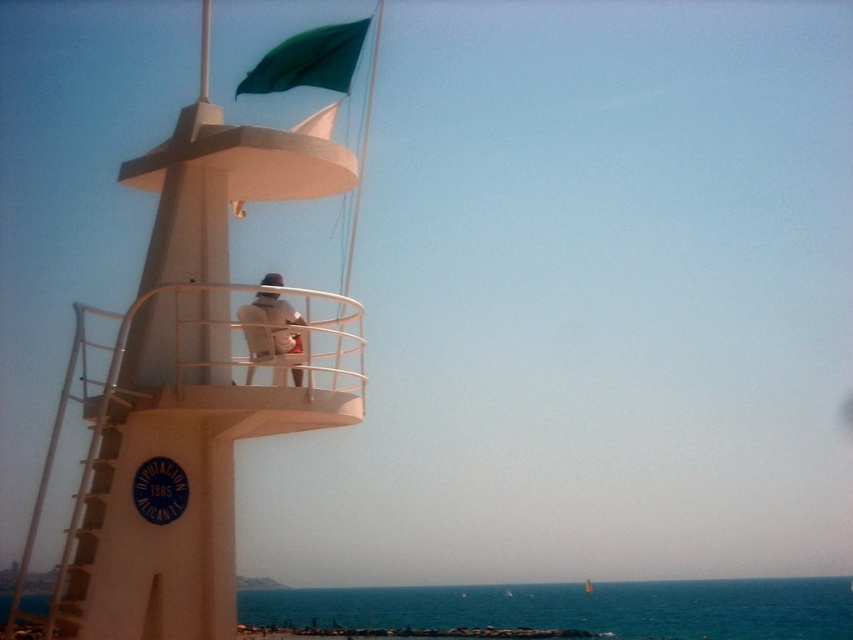
Describe the element at coordinates (204, 51) in the screenshot. This screenshot has height=640, width=853. I see `white glossy mast at upper center` at that location.

Is white glossy mast at upper center shorter than yellow fabric sailboat at center?

No, white glossy mast at upper center is not shorter than yellow fabric sailboat at center.

Which is behind, point (206, 88) or point (585, 579)?

The point (585, 579) is behind.

Find the location of a particular element. white glossy mast at upper center is located at coordinates (204, 51).

Which is more to the left, white matte tower at center or light brown leather jacket at center?

white matte tower at center is more to the left.

Is white matte tower at center to the left of light brown leather jacket at center from the viewer's perspective?

Correct, you'll find white matte tower at center to the left of light brown leather jacket at center.

Does point (184, 324) come in front of point (285, 344)?

Yes, it is in front of point (285, 344).

Find the location of `white matte tower at center`. white matte tower at center is located at coordinates (190, 387).

Does blue water at lower center lie in front of yellow fabric sailboat at center?

Yes, blue water at lower center is in front of yellow fabric sailboat at center.

Between point (715, 596) and point (585, 588), which one is positioned behind?

Positioned behind is point (715, 596).

The height and width of the screenshot is (640, 853). Identify the location of blue water at lower center. (578, 608).